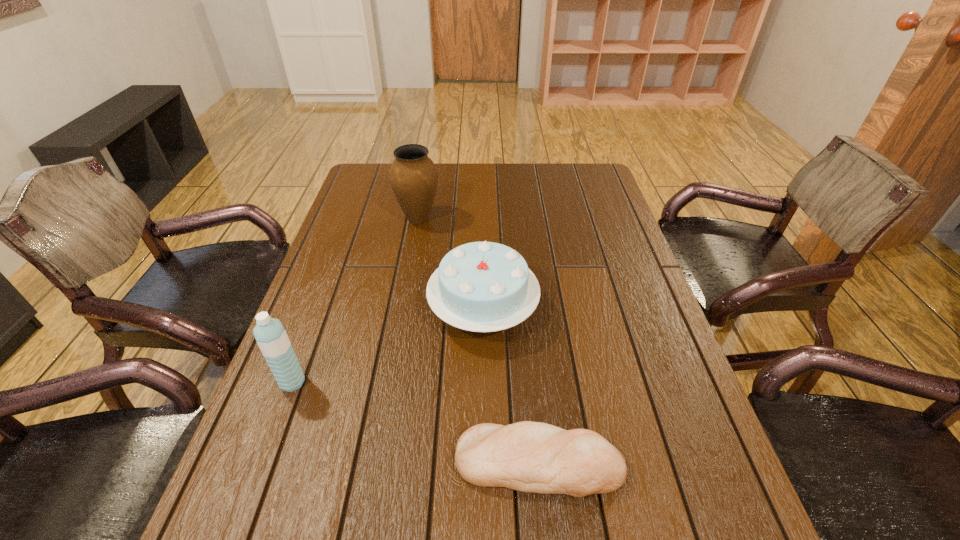
Locate an element on the screen. The height and width of the screenshot is (540, 960). vacant space that is in between the bread and the second farthest object is located at coordinates (511, 386).

The image size is (960, 540). What are the coordinates of `free space between the farthest object and the bread` in the screenshot? It's located at (478, 341).

Identify the location of free space between the water bottle and the birthday cake. This screenshot has width=960, height=540. (388, 346).

The width and height of the screenshot is (960, 540). Identify the location of object that can be found as the third closest to the birthday cake. (270, 335).

Where is `object that is the closest to the water bottle`? object that is the closest to the water bottle is located at coordinates (484, 286).